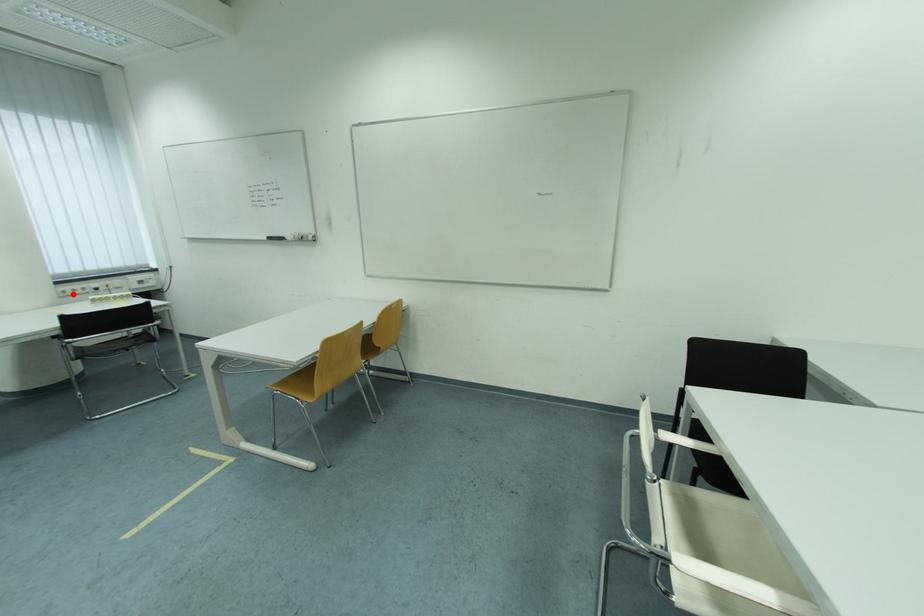
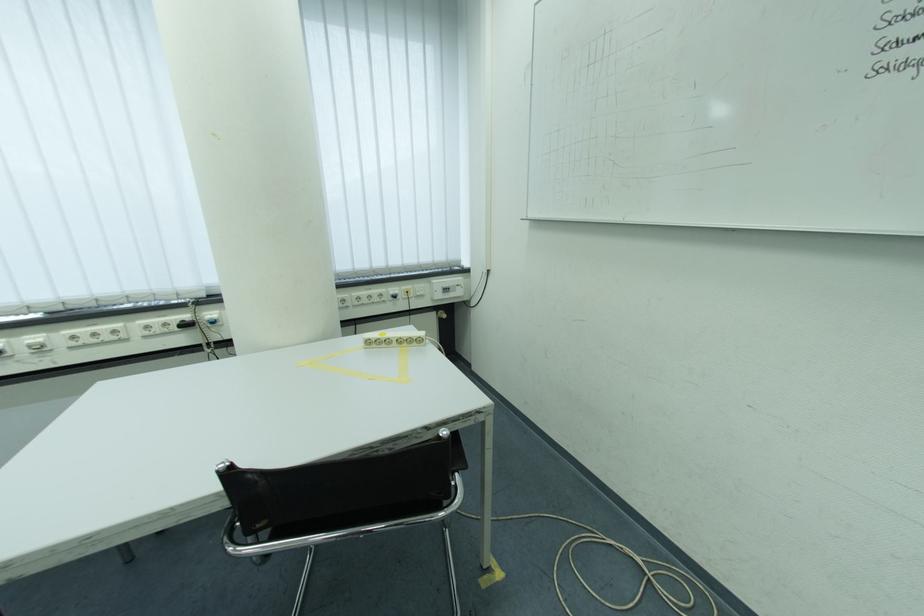
Locate, in the second image, the point that corresponds to the highlighted location in the first image.

(368, 301)